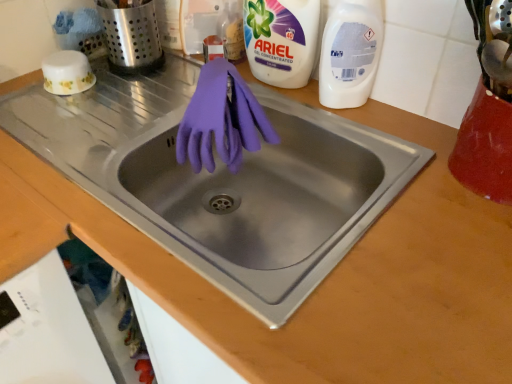
Question: Is purple rubber gloves at center in front of or behind white gel concentrated at upper right, which ranks as the first cleaning product in left-to-right order, in the image?

Choices:
 (A) behind
 (B) front

Answer: (B)

Question: From the image's perspective, is purple rubber gloves at center positioned above or below white gel concentrated at upper right, which ranks as the first cleaning product in left-to-right order?

Choices:
 (A) above
 (B) below

Answer: (B)

Question: Which object is positioned closest to the white plastic bottle at upper right, which is the second cleaning product from left to right?

Choices:
 (A) white plastic dishwasher at lower left
 (B) brushed metal utensil holder at upper left
 (C) white gel concentrated at upper right, which ranks as the first cleaning product in left-to-right order
 (D) purple rubber gloves at center
 (E) matte purple gloves at center

Answer: (C)

Question: Estimate the real-world distances between objects in this image. Which object is closer to the white gel concentrated at upper right, arranged as the 2th cleaning product when viewed from the right?

Choices:
 (A) matte purple gloves at center
 (B) brushed metal utensil holder at upper left
 (C) white plastic dishwasher at lower left
 (D) purple rubber gloves at center
 (E) white plastic bottle at upper right, marked as the first cleaning product in a right-to-left arrangement

Answer: (E)